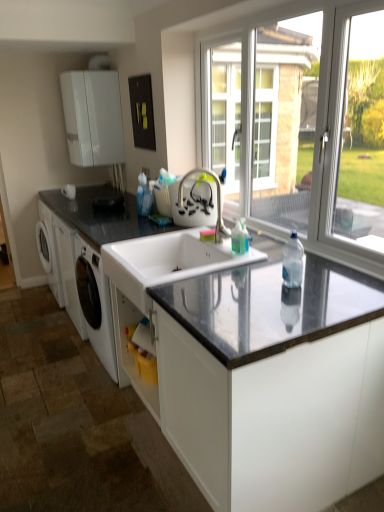
Question: Is transparent glass window at upper right at the left side of white ceramic sink at center?

Choices:
 (A) yes
 (B) no

Answer: (B)

Question: Does transparent glass window at upper right have a lesser width compared to white ceramic sink at center?

Choices:
 (A) no
 (B) yes

Answer: (B)

Question: Considering the relative sizes of transparent glass window at upper right and white ceramic sink at center in the image provided, is transparent glass window at upper right wider than white ceramic sink at center?

Choices:
 (A) yes
 (B) no

Answer: (B)

Question: Is transparent glass window at upper right smaller than white ceramic sink at center?

Choices:
 (A) yes
 (B) no

Answer: (B)

Question: Is transparent glass window at upper right facing towards white ceramic sink at center?

Choices:
 (A) yes
 (B) no

Answer: (A)

Question: From the image's perspective, would you say transparent glass window at upper right is shown under white ceramic sink at center?

Choices:
 (A) no
 (B) yes

Answer: (A)

Question: Is black granite countertop at left, which ranks as the 2th countertop in bottom-to-top order, at the right side of transparent glass window at upper right?

Choices:
 (A) yes
 (B) no

Answer: (B)

Question: Is black granite countertop at left, which is the first countertop in top-to-bottom order, wider than transparent glass window at upper right?

Choices:
 (A) no
 (B) yes

Answer: (B)

Question: Is black granite countertop at left, which ranks as the 2th countertop in bottom-to-top order, closer to camera compared to transparent glass window at upper right?

Choices:
 (A) no
 (B) yes

Answer: (A)

Question: From a real-world perspective, is black granite countertop at left, which ranks as the 2th countertop in bottom-to-top order, over transparent glass window at upper right?

Choices:
 (A) no
 (B) yes

Answer: (A)

Question: Does black granite countertop at left, which is the first countertop in top-to-bottom order, have a smaller size compared to transparent glass window at upper right?

Choices:
 (A) yes
 (B) no

Answer: (A)

Question: Is black granite countertop at left, which ranks as the 2th countertop in bottom-to-top order, to the left of transparent glass window at upper right from the viewer's perspective?

Choices:
 (A) yes
 (B) no

Answer: (A)

Question: From the image's perspective, is white matte cabinet at upper left over satin nickel faucet at center?

Choices:
 (A) no
 (B) yes

Answer: (B)